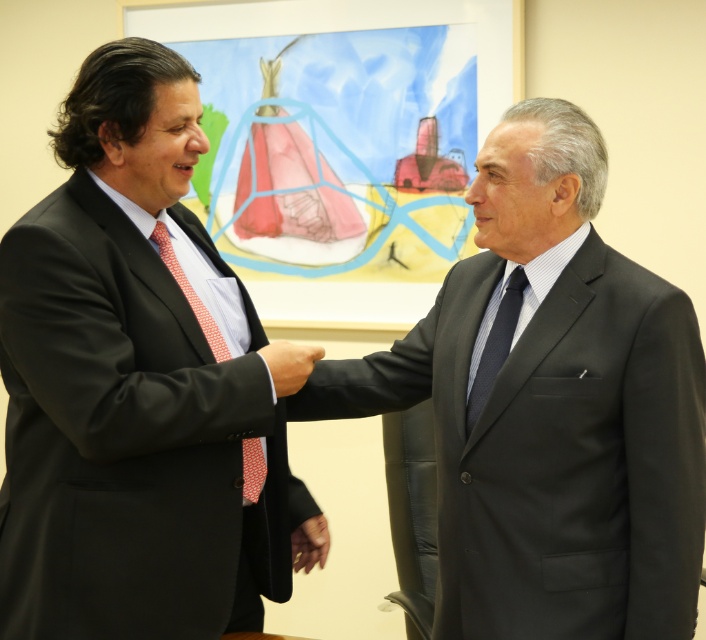
Between red dotted tie at center and dark blue textured tie at center, which one appears on the left side from the viewer's perspective?

red dotted tie at center

Can you confirm if red dotted tie at center is thinner than dark blue textured tie at center?

In fact, red dotted tie at center might be wider than dark blue textured tie at center.

Image resolution: width=706 pixels, height=640 pixels. What are the coordinates of `red dotted tie at center` in the screenshot? It's located at (189, 292).

Is matte black suit at center in front of dark blue textured tie at center?

Yes, it is.

Does matte black suit at center appear under dark blue textured tie at center?

Yes.

Locate an element on the screen. matte black suit at center is located at coordinates (137, 387).

Is dark gray suit at center wider than dark blue textured tie at center?

Correct, the width of dark gray suit at center exceeds that of dark blue textured tie at center.

Between point (382, 392) and point (467, 401), which one is positioned in front?

Point (467, 401) is more forward.

Where is `dark gray suit at center`? The height and width of the screenshot is (640, 706). dark gray suit at center is located at coordinates (549, 406).